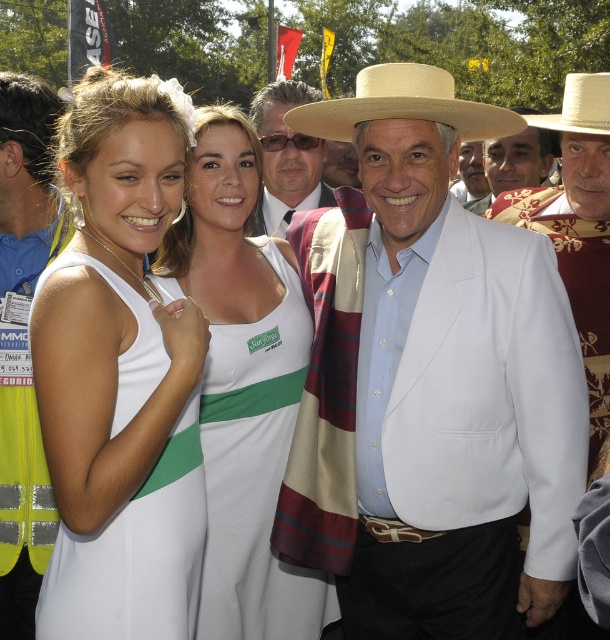
Does point (242, 490) come closer to viewer compared to point (300, 140)?

Yes, it is.

Is point (242, 582) behind point (298, 90)?

No, (242, 582) is closer to viewer.

Locate an element on the screen. Image resolution: width=610 pixels, height=640 pixels. white fabric dress at center is located at coordinates [242, 385].

Which is below, white cotton suit at center or white cotton hat at center?

Positioned lower is white cotton suit at center.

Image resolution: width=610 pixels, height=640 pixels. Describe the element at coordinates (578, 228) in the screenshot. I see `white cotton suit at center` at that location.

At what (x,y) coordinates should I click in order to perform the action: click on white cotton suit at center. Please return your answer as a coordinate pair (x, y). This screenshot has height=640, width=610. Looking at the image, I should click on (578, 228).

Between white cotton shirt at center and white cotton hat at center, which one appears on the left side from the viewer's perspective?

From the viewer's perspective, white cotton shirt at center appears more on the left side.

Where is `white cotton shirt at center`? Image resolution: width=610 pixels, height=640 pixels. white cotton shirt at center is located at coordinates (23, 340).

Identify the location of white cotton shirt at center. (23, 340).